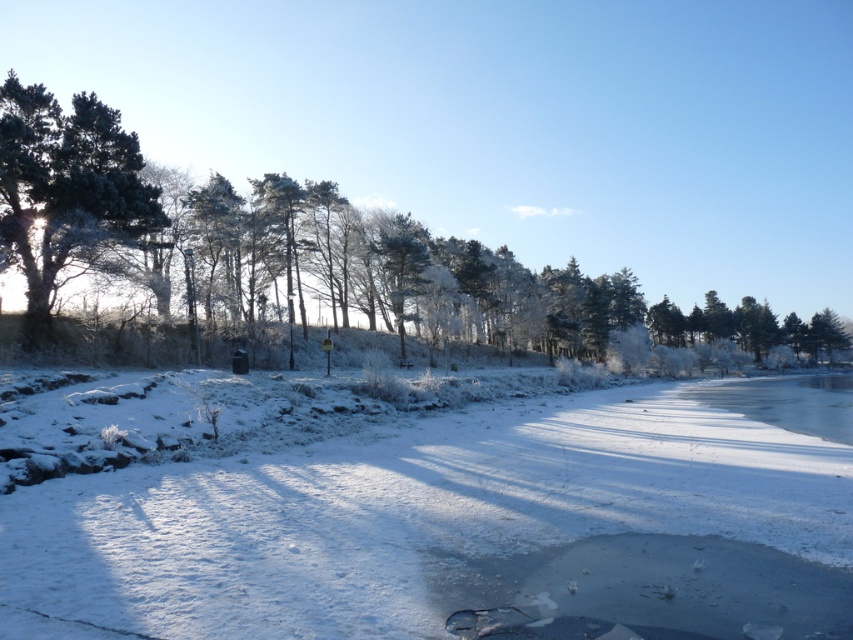
In the scene shown: Which of these two, green frosted tree at left or glossy dark green tree at upper left, stands taller?

Standing taller between the two is green frosted tree at left.

Does point (146, 196) come closer to viewer compared to point (123, 184)?

No.

Who is more distant from viewer, (239, 259) or (33, 243)?

Positioned behind is point (239, 259).

The width and height of the screenshot is (853, 640). What are the coordinates of `green frosted tree at left` in the screenshot? It's located at (166, 225).

Does white frosty snow at center have a lesser height compared to frosted glass tree at center?

Indeed, white frosty snow at center has a lesser height compared to frosted glass tree at center.

Can you confirm if white frosty snow at center is wider than frosted glass tree at center?

Yes.

Who is more distant from viewer, (x=169, y=532) or (x=419, y=292)?

The point (x=419, y=292) is behind.

Locate an element on the screen. This screenshot has height=640, width=853. white frosty snow at center is located at coordinates (403, 516).

Can you confirm if glossy dark green tree at upper left is smaller than frosted glass tree at center?

Indeed, glossy dark green tree at upper left has a smaller size compared to frosted glass tree at center.

Consider the image. Is glossy dark green tree at upper left thinner than frosted glass tree at center?

In fact, glossy dark green tree at upper left might be wider than frosted glass tree at center.

Who is more forward, [80,204] or [413,244]?

Point [80,204] is more forward.

The width and height of the screenshot is (853, 640). I want to click on glossy dark green tree at upper left, so click(x=65, y=189).